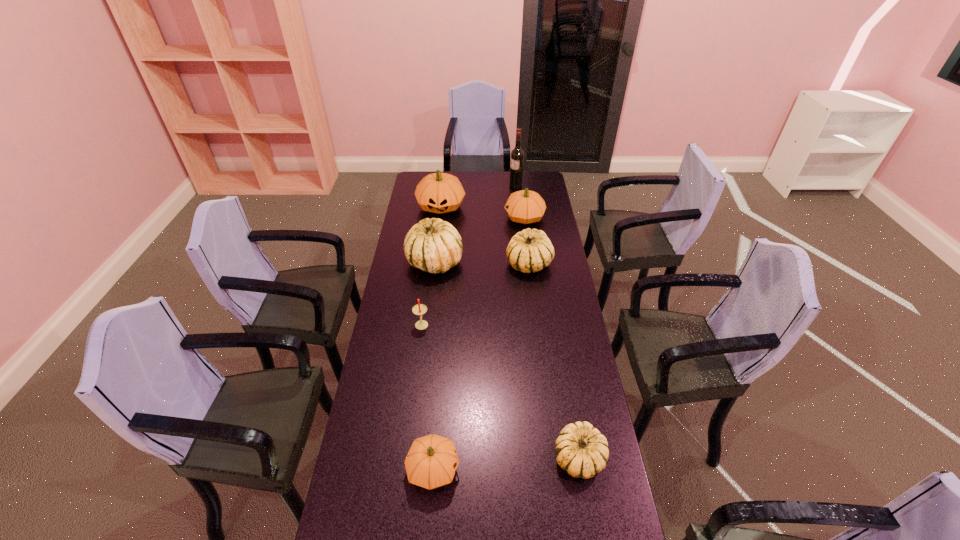
This screenshot has height=540, width=960. Identify the location of gourd that is the second closest to the second biggest white gourd. (433, 245).

Identify the location of gourd that is the nearest to the biggest orange gourd. The height and width of the screenshot is (540, 960). (433, 245).

The height and width of the screenshot is (540, 960). Find the location of `the closest orange gourd relative to the second smallest white gourd`. the closest orange gourd relative to the second smallest white gourd is located at coordinates (525, 206).

Locate an element on the screen. This screenshot has width=960, height=540. orange gourd that stands as the closest to the smallest orange gourd is located at coordinates (525, 206).

Find the location of `the closest white gourd relative to the second biggest white gourd`. the closest white gourd relative to the second biggest white gourd is located at coordinates (433, 245).

Image resolution: width=960 pixels, height=540 pixels. Find the location of `white gourd that is the third closest to the candle`. white gourd that is the third closest to the candle is located at coordinates (581, 450).

Where is `vacant space that satisfies the following two spatial constraints: 1. on the side of the biggest orange gourd with the carved face; 2. on the left side of the nearest white gourd`? Image resolution: width=960 pixels, height=540 pixels. vacant space that satisfies the following two spatial constraints: 1. on the side of the biggest orange gourd with the carved face; 2. on the left side of the nearest white gourd is located at coordinates (411, 458).

Locate an element on the screen. This screenshot has width=960, height=540. vacant point that satisfies the following two spatial constraints: 1. on the front and back of the wine bottle; 2. on the back side of the smallest white gourd is located at coordinates (547, 458).

Find the location of a particular element. Image resolution: width=960 pixels, height=540 pixels. vacant point that satisfies the following two spatial constraints: 1. on the side of the biggest white gourd with the carved face; 2. on the right side of the biggest orange gourd is located at coordinates click(x=434, y=262).